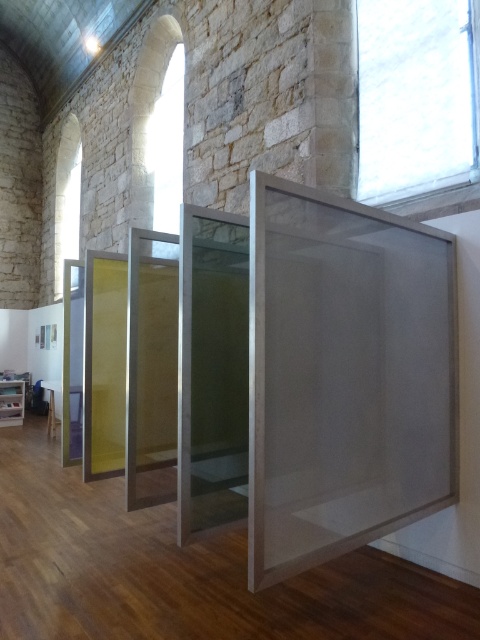
You are an art curator arranging a new exhibit. You have two items to display in the transparent mesh box at center and the transparent glass box at left. Which box should you place the item that requires more visibility from all angles? Explain your choice based on their positions.

The transparent glass box at left is better for items needing visibility from all angles since it is positioned to the left of the transparent mesh box at center. Glass typically offers clearer transparency compared to mesh, allowing better all around visibility.

You are an art curator planning to move a sculpture that is 20 feet long into this space. You want to place it between the transparent mesh box at center and the transparent glass box at left. Is there enough space for the sculpture to fit between them?

The transparent mesh box at center is 24.07 feet from the transparent glass box at left. Since the sculpture is 20 feet long, there is enough space between them for the sculpture to fit.

You are an art curator planning to display a new sculpture that requires a base of at least 1 meter in width. You have two options in the room, the transparent mesh box at center and the transparent glass box at left. Which one can accommodate the sculpture based on their sizes?

The transparent mesh box at center has a larger width than the transparent glass box at left, so it can accommodate the sculpture requiring a base of at least 1 meter in width.